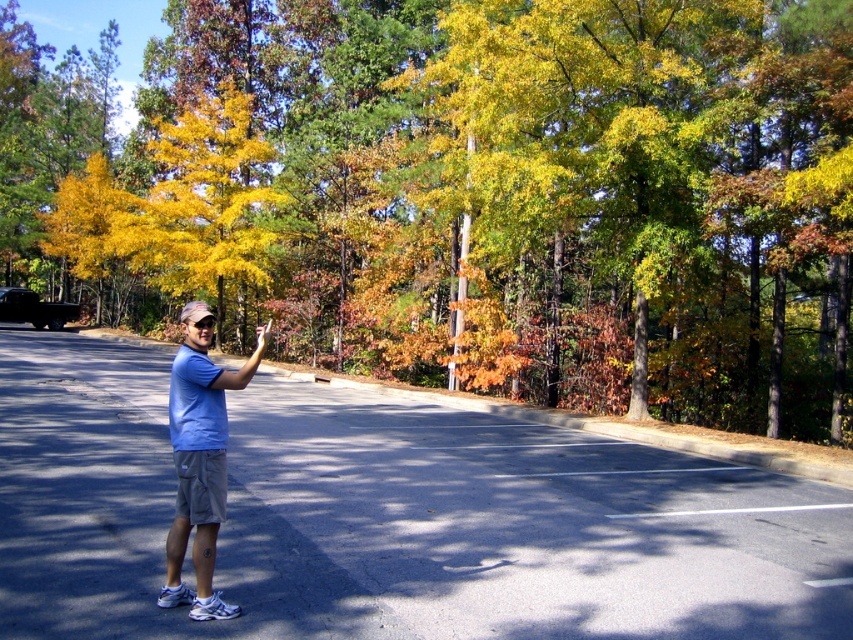
Question: Is yellow leafy tree at center bigger than blue cotton shirt at center?

Choices:
 (A) yes
 (B) no

Answer: (A)

Question: Among these points, which one is farthest from the camera?

Choices:
 (A) (328, 134)
 (B) (195, 568)

Answer: (A)

Question: Does yellow leafy tree at center appear on the right side of blue cotton shirt at center?

Choices:
 (A) yes
 (B) no

Answer: (B)

Question: Which of the following is the farthest from the observer?

Choices:
 (A) (834, 81)
 (B) (170, 525)

Answer: (A)

Question: Is yellow leafy tree at center below blue cotton shirt at center?

Choices:
 (A) yes
 (B) no

Answer: (B)